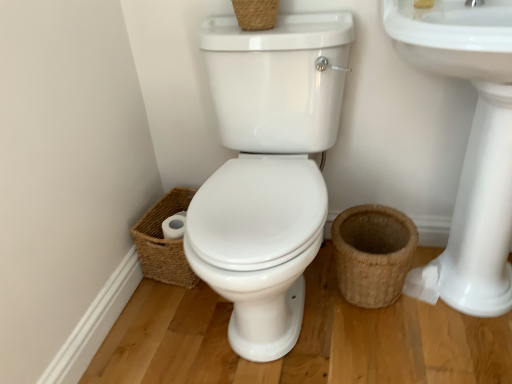
The width and height of the screenshot is (512, 384). Identify the location of free space in front of brown woven basket at lower right, which appears as the 3th basket when viewed from the left. (394, 353).